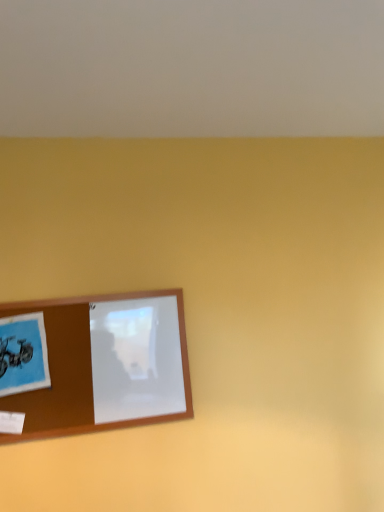
Question: From their relative heights in the image, would you say brown wooden picture frame at lower left is taller or shorter than blue matte postcard at lower left?

Choices:
 (A) short
 (B) tall

Answer: (B)

Question: Would you say brown wooden picture frame at lower left is to the left or to the right of blue matte postcard at lower left in the picture?

Choices:
 (A) right
 (B) left

Answer: (A)

Question: Considering the positions of point (157, 418) and point (6, 346), is point (157, 418) closer or farther from the camera than point (6, 346)?

Choices:
 (A) closer
 (B) farther

Answer: (B)

Question: Does point (34, 324) appear closer or farther from the camera than point (66, 382)?

Choices:
 (A) farther
 (B) closer

Answer: (A)

Question: Considering the positions of blue matte postcard at lower left and brown wooden picture frame at lower left in the image, is blue matte postcard at lower left bigger or smaller than brown wooden picture frame at lower left?

Choices:
 (A) small
 (B) big

Answer: (A)

Question: Choose the correct answer: Is blue matte postcard at lower left inside brown wooden picture frame at lower left or outside it?

Choices:
 (A) inside
 (B) outside

Answer: (A)

Question: Is blue matte postcard at lower left to the left or to the right of brown wooden picture frame at lower left in the image?

Choices:
 (A) right
 (B) left

Answer: (B)